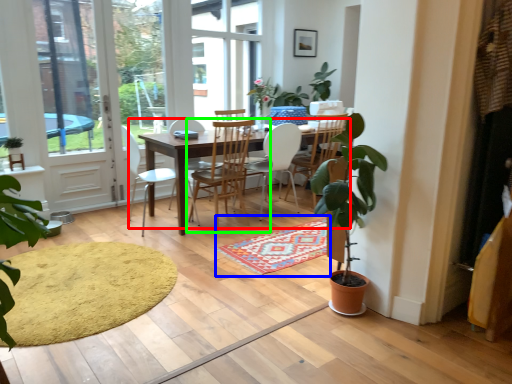
Question: Estimate the real-world distances between objects in this image. Which object is closer to kitchen & dining room table (highlighted by a red box), doormat (highlighted by a blue box) or chair (highlighted by a green box)?

Choices:
 (A) doormat
 (B) chair

Answer: (B)